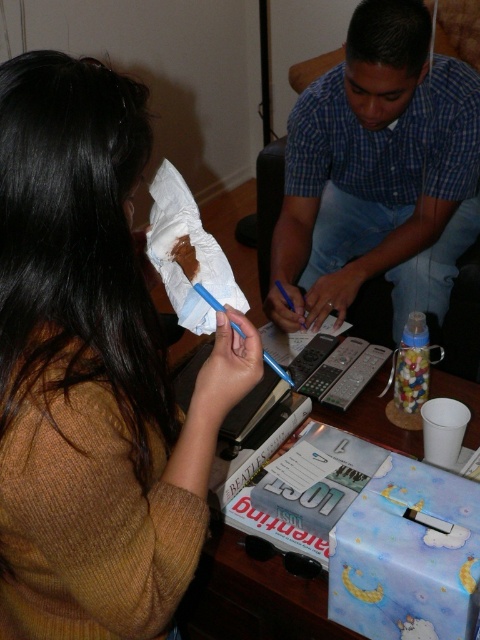
Question: Does blue plaid shirt at center appear under white paper towel at upper center?

Choices:
 (A) no
 (B) yes

Answer: (A)

Question: Which object is closer to the camera taking this photo?

Choices:
 (A) white soft toilet paper at center
 (B) blue plaid shirt at center
 (C) brown knitted sweater at upper left
 (D) white paper towel at upper center

Answer: (C)

Question: Does brown knitted sweater at upper left appear under white paper towel at upper center?

Choices:
 (A) no
 (B) yes

Answer: (B)

Question: Estimate the real-world distances between objects in this image. Which object is closer to the white paper towel at upper center?

Choices:
 (A) blue plaid shirt at center
 (B) brown knitted sweater at upper left
 (C) white soft toilet paper at center

Answer: (C)

Question: Which of the following is the farthest from the observer?

Choices:
 (A) white paper towel at upper center
 (B) blue plaid shirt at center
 (C) white soft toilet paper at center
 (D) brown knitted sweater at upper left

Answer: (B)

Question: Is blue plaid shirt at center to the right of white soft toilet paper at center from the viewer's perspective?

Choices:
 (A) no
 (B) yes

Answer: (B)